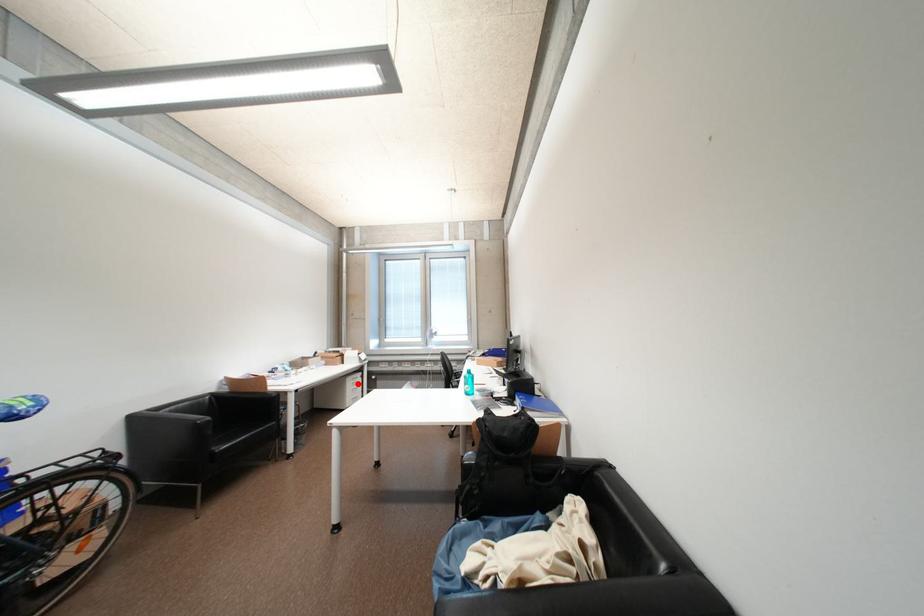
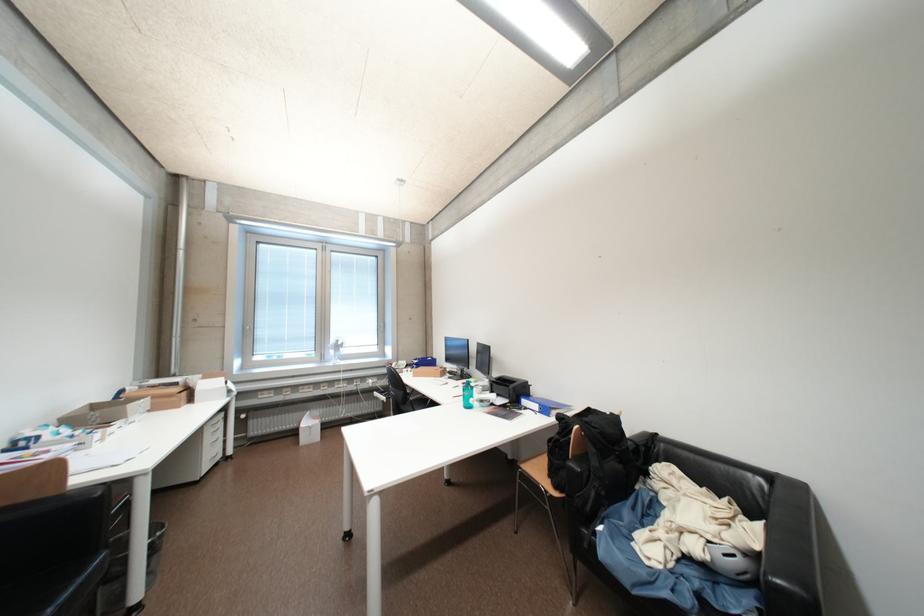
Locate, in the second image, the point that corresponds to the highlighted location in the first image.

(216, 432)